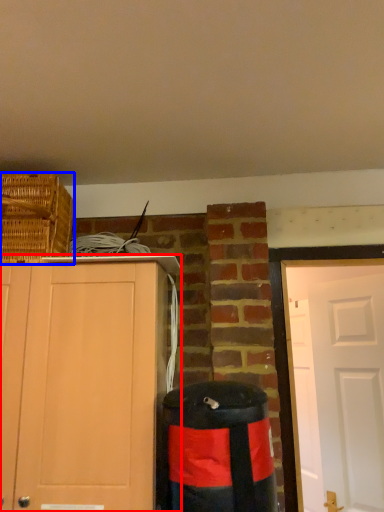
Question: Which point is closer to the camera, cabinetry (highlighted by a red box) or basket (highlighted by a blue box)?

Choices:
 (A) cabinetry
 (B) basket

Answer: (A)